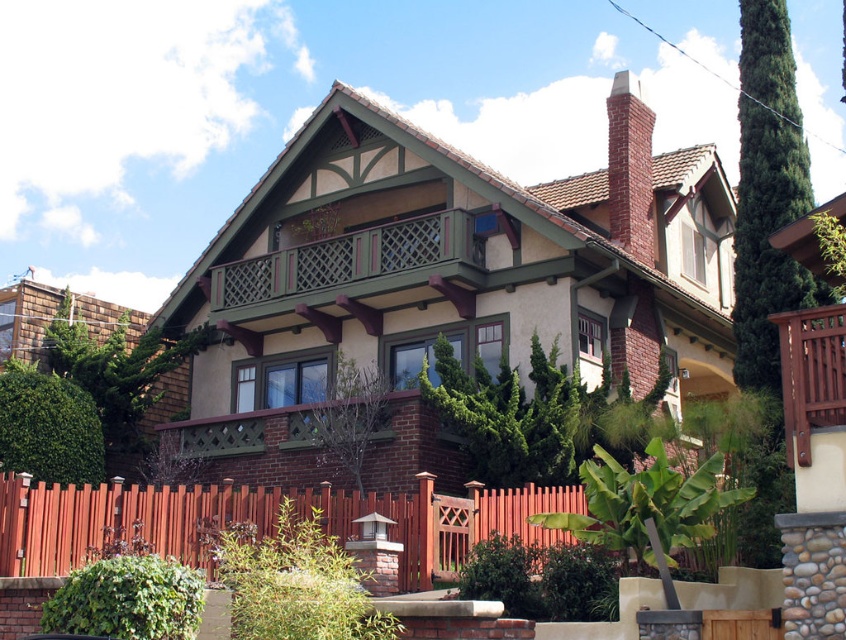
You are standing in front of the house and want to determine the relative positions of two points marked on the facade. Which point, point (37, 554) or point (638, 145), is closer to you?

Point (37, 554) is closer to the viewer than point (638, 145).